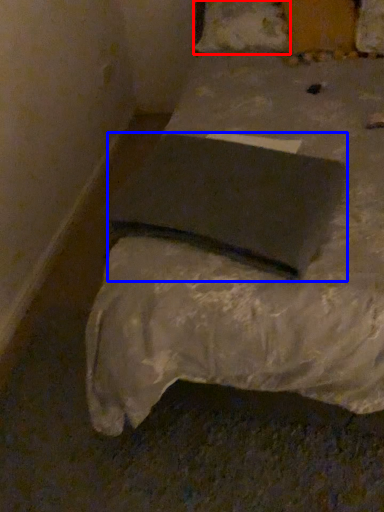
Question: Which object is closer to the camera taking this photo, pillow (highlighted by a red box) or pad (highlighted by a blue box)?

Choices:
 (A) pillow
 (B) pad

Answer: (B)